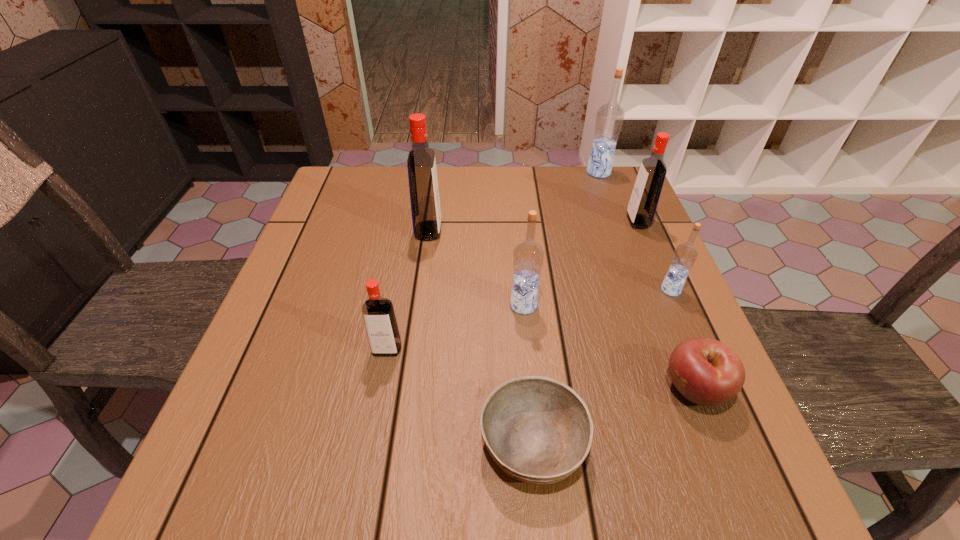
Where is `free space at the near right corner of the desktop`? Image resolution: width=960 pixels, height=540 pixels. free space at the near right corner of the desktop is located at coordinates pyautogui.click(x=686, y=456).

I want to click on empty location between the rightmost blue vodka and the second biggest red vodka, so click(x=655, y=255).

Where is `vacant region between the shortest object and the third nearest object`? The height and width of the screenshot is (540, 960). vacant region between the shortest object and the third nearest object is located at coordinates (460, 396).

Image resolution: width=960 pixels, height=540 pixels. I want to click on free space that is in between the nearest vodka and the biggest red vodka, so click(408, 290).

Find the location of a particular element. Image resolution: width=960 pixels, height=540 pixels. vacant area between the second shortest object and the biggest red vodka is located at coordinates (562, 310).

Find the location of a particular element. free spot between the second blue vodka from right to left and the rightmost red vodka is located at coordinates (618, 197).

Find the location of a particular element. The height and width of the screenshot is (540, 960). free space between the biggest red vodka and the sixth farthest object is located at coordinates (408, 290).

Find the location of a particular element. This screenshot has height=540, width=960. free area in between the bowl and the second biggest red vodka is located at coordinates (586, 332).

Identify the location of free space between the bowl and the rightmost red vodka. (586, 332).

The height and width of the screenshot is (540, 960). I want to click on vacant space that is in between the biggest red vodka and the biggest blue vodka, so click(x=514, y=202).